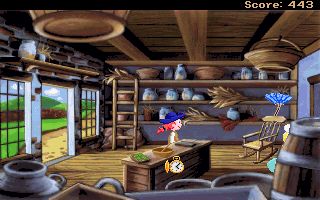
Locate an element on the screen. The width and height of the screenshot is (320, 200). chair is located at coordinates [x=257, y=140].